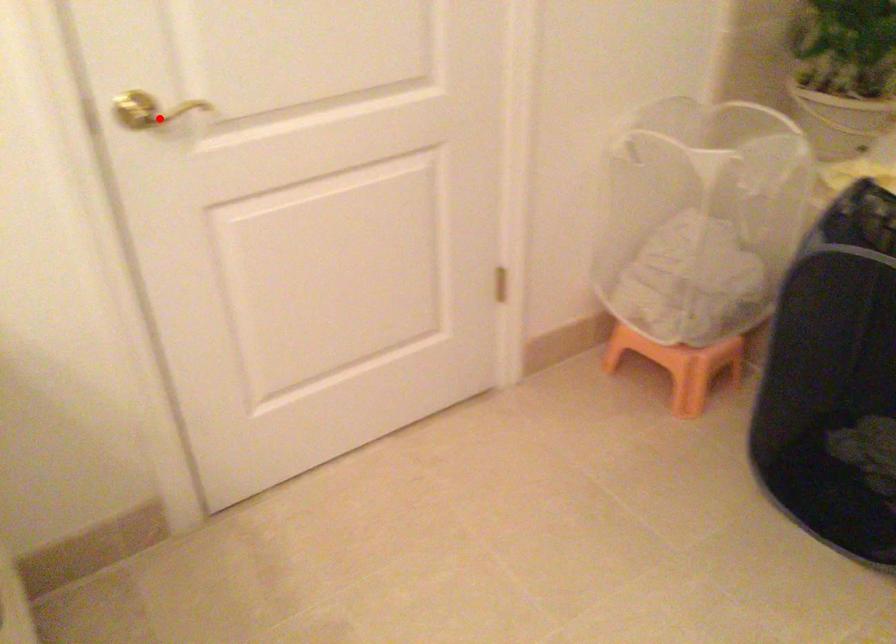
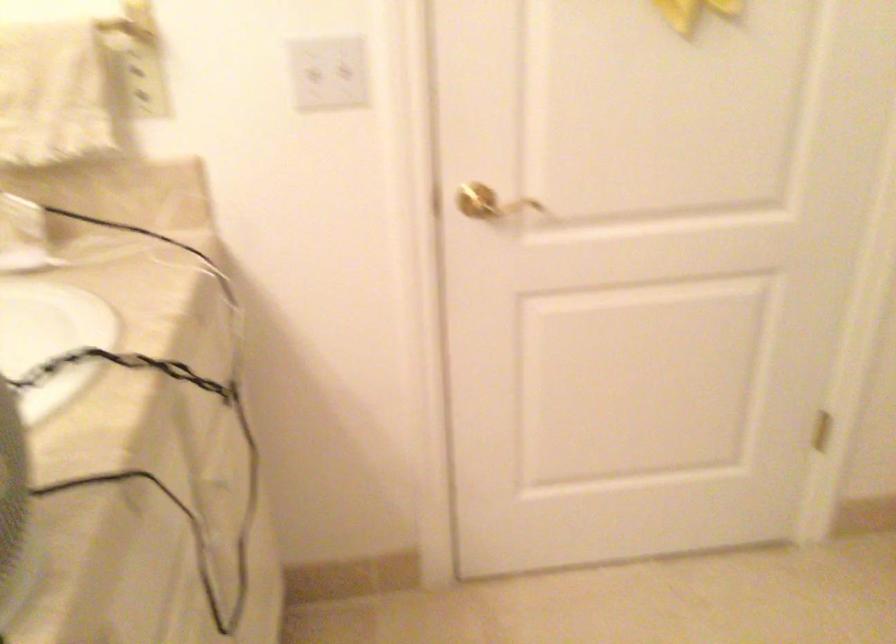
Find the pixel in the second image that matches the highlighted location in the first image.

(489, 203)